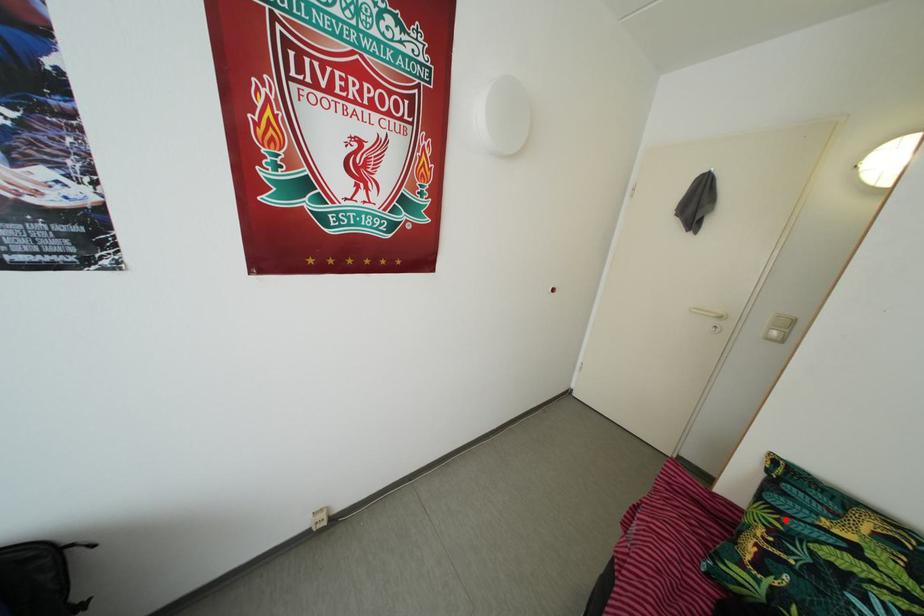
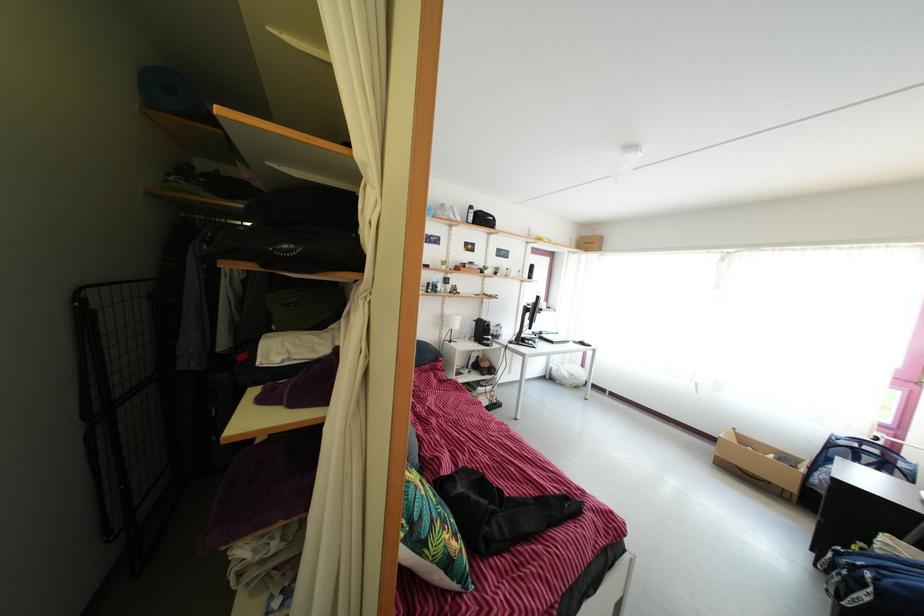
Question: I am providing you with two images of the same scene from different viewpoints. In image1, a red point is highlighted. Considering the same 3D point in image2, which of the following is correct?

Choices:
 (A) It is closer
 (B) It is farther

Answer: (A)